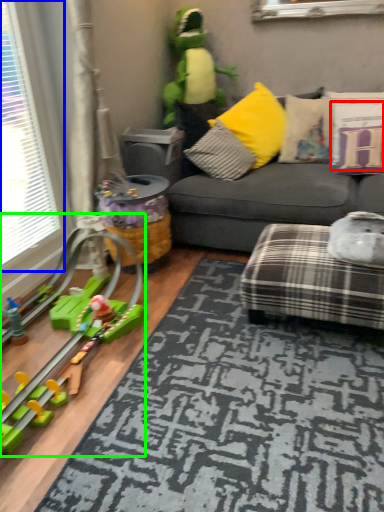
Question: Based on their relative distances, which object is nearer to pillow (highlighted by a red box)? Choose from window (highlighted by a blue box) and toy (highlighted by a green box).

Choices:
 (A) window
 (B) toy

Answer: (B)